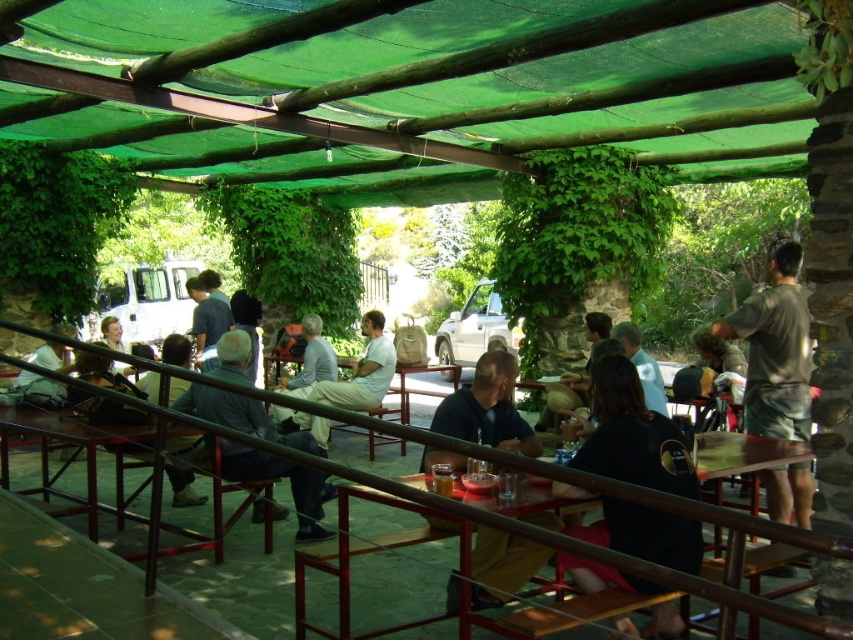
You are standing at the center of the seating area and want to place a new bench. The bench needs to be placed at point (64,444). Can you confirm if this point is near the wooden table at lower left?

Yes, the point (64,444) corresponds to the wooden table at lower left, so placing the bench there would position it near the wooden table at lower left.

You are a delivery person who needs to place a package between the matte brown bag at center and the matte black backpack at left. The package requires a minimum of 10 feet of space to ensure it doesn not interfere with either item. Can you safely place the package there?

The distance between the matte brown bag at center and the matte black backpack at left is 11.45 feet, which is more than the required 10 feet. Therefore, you can safely place the package between them without interfering with either item.

You are standing at point (618, 332) and want to walk to the entrance located at point (584, 326). Is the entrance in front of or behind you?

The entrance at point (584, 326) is behind you because point (584, 326) is behind point (618, 332).